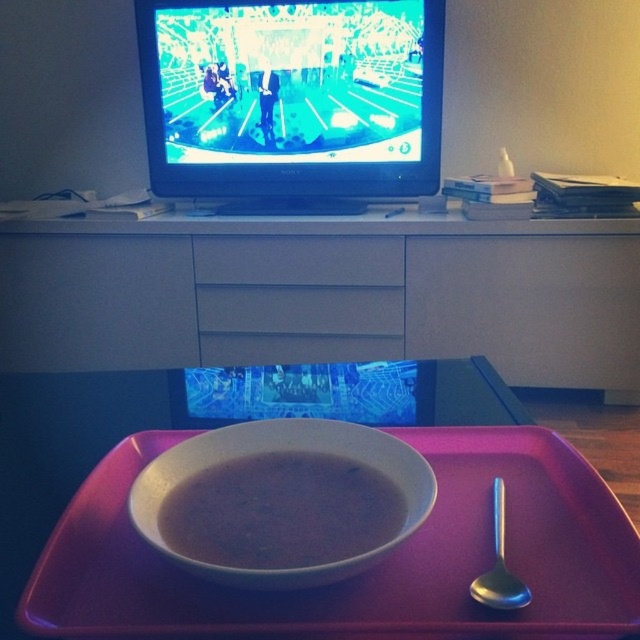
You are placing a new decorative item on the matte white cabinet at upper center and the pink plastic tray at center. Which surface is to the left of the other?

The matte white cabinet at upper center is positioned on the left side of the pink plastic tray at center, so it is to the left of the pink plastic tray at center.

You are a photographer trying to capture a closeup of the white speckled bowl at center. If your camera requires the subject to be within 15 inches to focus properly, will you need to move closer or farther away?

The white speckled bowl at center is 16.74 inches away from the camera, which is beyond the 15 inch focus range. You need to move closer to the white speckled bowl at center to get it in focus.

You are setting up a dining area and need to place both the pink plastic tray at center and the matte white drawer at center on a table. Given their sizes, which object should you place first to ensure stability?

The pink plastic tray at center is larger in size than the matte white drawer at center, so you should place the pink plastic tray at center first to provide a stable base for the smaller matte white drawer at center.